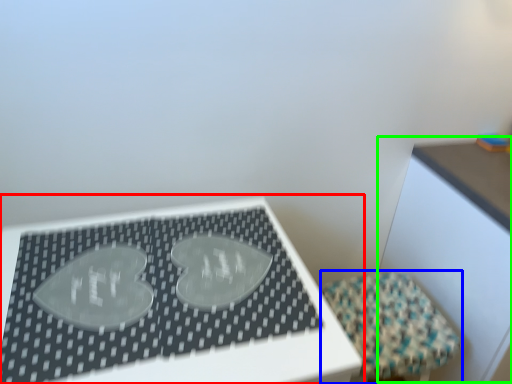
Question: Considering the real-world distances, which object is closest to table (highlighted by a red box)? furniture (highlighted by a blue box) or table (highlighted by a green box).

Choices:
 (A) furniture
 (B) table

Answer: (A)